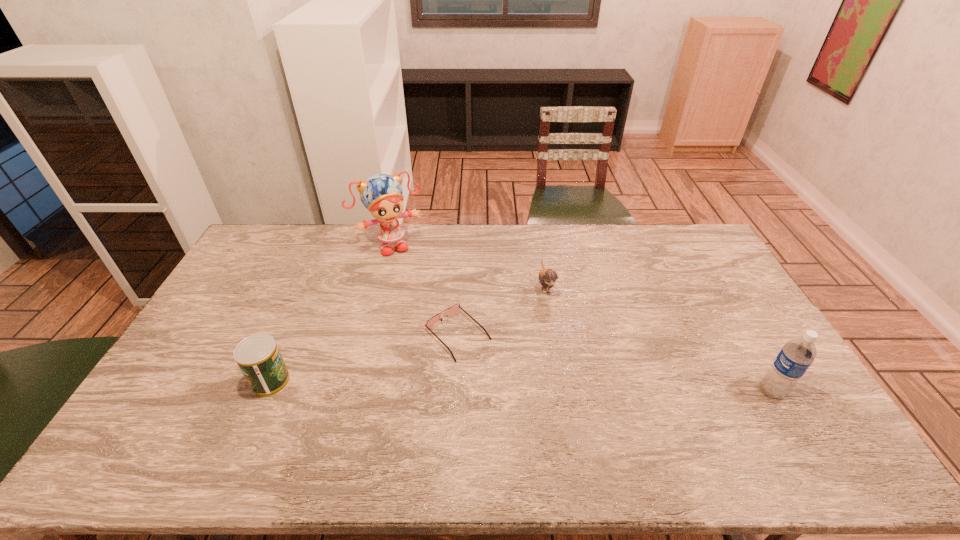
The image size is (960, 540). In order to click on free space located 0.230m on the back of the leftmost object in this screenshot , I will do `click(301, 310)`.

The image size is (960, 540). I want to click on free spot located on the back of the water bottle, so click(752, 359).

Where is `vacant area situated on the face of the second object from left to right`? Image resolution: width=960 pixels, height=540 pixels. vacant area situated on the face of the second object from left to right is located at coordinates (410, 273).

Find the location of a particular element. The width and height of the screenshot is (960, 540). free spot located on the face of the second object from left to right is located at coordinates (433, 315).

I want to click on free space located on the face of the second object from left to right, so click(x=422, y=295).

I want to click on free region located on the bridge of the shortest object, so click(x=526, y=402).

Locate an element on the screen. vacant area situated on the bridge of the shortest object is located at coordinates (494, 371).

At what (x,y) coordinates should I click in order to perform the action: click on vacant space located on the bridge of the shortest object. Please return your answer as a coordinate pair (x, y). The height and width of the screenshot is (540, 960). Looking at the image, I should click on (516, 392).

At what (x,y) coordinates should I click in order to perform the action: click on blank area located on the front-facing side of the kitten. Please return your answer as a coordinate pair (x, y). Looking at the image, I should click on (574, 371).

At what (x,y) coordinates should I click in order to perform the action: click on free space located on the front-facing side of the kitten. Please return your answer as a coordinate pair (x, y). The image size is (960, 540). Looking at the image, I should click on (580, 388).